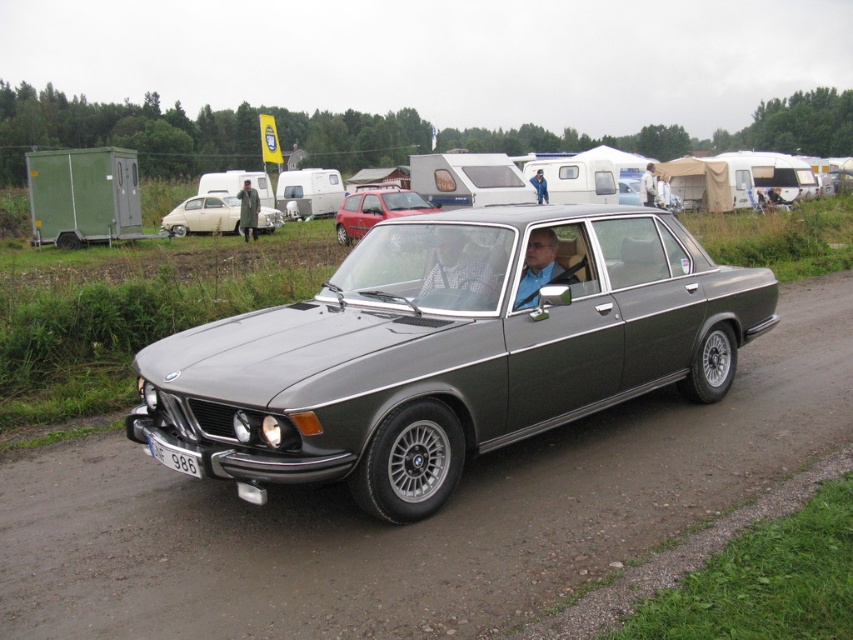
Question: Which point is closer to the camera?

Choices:
 (A) (570, 273)
 (B) (541, 193)
 (C) (340, 317)

Answer: (C)

Question: Estimate the real-world distances between objects in this image. Which object is closer to the blue fabric jacket at center?

Choices:
 (A) matte gray sedan at center
 (B) beige matte sedan at center

Answer: (A)

Question: Considering the relative positions of matte gray sedan at center and green matte jacket at center in the image provided, where is matte gray sedan at center located with respect to green matte jacket at center?

Choices:
 (A) above
 (B) below

Answer: (A)

Question: Does gray asphalt road at center have a larger size compared to checkered fabric shirt at center?

Choices:
 (A) no
 (B) yes

Answer: (A)

Question: Which point is closer to the camera taking this photo?

Choices:
 (A) (671, 522)
 (B) (463, 257)

Answer: (A)

Question: Does satin grey car at center have a larger size compared to green matte jacket at center?

Choices:
 (A) yes
 (B) no

Answer: (B)